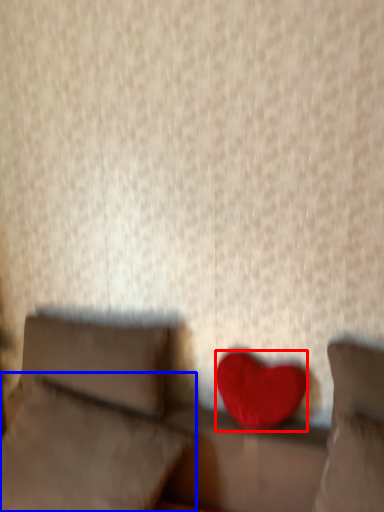
Question: Which object appears closest to the camera in this image, heart (highlighted by a red box) or pillow (highlighted by a blue box)?

Choices:
 (A) heart
 (B) pillow

Answer: (B)